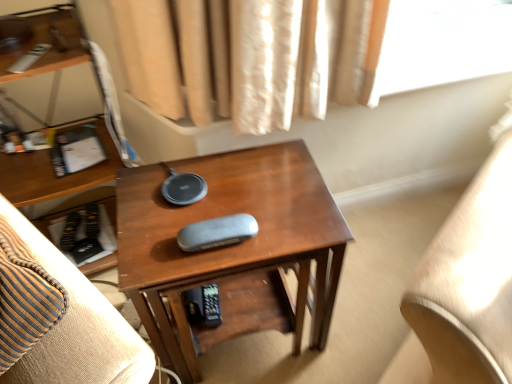
You are a GUI agent. You are given a task and a screenshot of the screen. Output one action in this format:
    pyautogui.click(x=<x>, y=<y>)
    Task: Click on the wooden side table at center
    The height and width of the screenshot is (384, 512).
    Given the screenshot: What is the action you would take?
    pyautogui.click(x=80, y=326)

What do you see at coordinates (80, 326) in the screenshot?
I see `wooden side table at center` at bounding box center [80, 326].

Measure the distance between shiny brown desk at center and camera.

A distance of 31.53 inches exists between shiny brown desk at center and camera.

The width and height of the screenshot is (512, 384). Describe the element at coordinates (231, 246) in the screenshot. I see `shiny brown desk at center` at that location.

The width and height of the screenshot is (512, 384). I want to click on shiny brown desk at center, so click(231, 246).

Locate an element on the screen. This screenshot has width=512, height=384. wooden side table at center is located at coordinates (80, 326).

Does shiny brown desk at center appear on the left side of wooden side table at center?

No, shiny brown desk at center is not to the left of wooden side table at center.

Is shiny brown desk at center closer to the viewer compared to wooden side table at center?

No, shiny brown desk at center is further to the viewer.

Is point (312, 197) positioned behind point (22, 373)?

Yes, point (312, 197) is farther from viewer.

From the image's perspective, is shiny brown desk at center positioned above or below wooden side table at center?

From the image's perspective, shiny brown desk at center appears below wooden side table at center.

From a real-world perspective, is shiny brown desk at center over wooden side table at center?

No.

Between shiny brown desk at center and wooden side table at center, which one has larger width?

Wider between the two is wooden side table at center.

Which of these two, shiny brown desk at center or wooden side table at center, stands taller?

Standing taller between the two is shiny brown desk at center.

Does shiny brown desk at center have a larger size compared to wooden side table at center?

Indeed, shiny brown desk at center has a larger size compared to wooden side table at center.

Based on the photo, is shiny brown desk at center inside the boundaries of wooden side table at center, or outside?

shiny brown desk at center is not enclosed by wooden side table at center.

Can you see shiny brown desk at center touching wooden side table at center?

No, shiny brown desk at center is not beside wooden side table at center.

Could you tell me if shiny brown desk at center is facing wooden side table at center?

No, shiny brown desk at center is not facing towards wooden side table at center.

What's the angular difference between shiny brown desk at center and wooden side table at center's facing directions?

The angular difference between shiny brown desk at center and wooden side table at center is 22.4 degrees.

How distant is shiny brown desk at center from wooden side table at center?

The distance of shiny brown desk at center from wooden side table at center is 37.29 centimeters.

This screenshot has height=384, width=512. Find the location of `desk on the right of wooden side table at center`. desk on the right of wooden side table at center is located at coordinates pos(231,246).

Would you say wooden side table at center is to the left or to the right of shiny brown desk at center in the picture?

In the image, wooden side table at center appears on the left side of shiny brown desk at center.

Is wooden side table at center further to the viewer compared to shiny brown desk at center?

No, wooden side table at center is closer to the camera.

Which point is more forward, (137, 377) or (285, 184)?

Point (137, 377)

From the image's perspective, does wooden side table at center appear higher than shiny brown desk at center?

Correct, wooden side table at center appears higher than shiny brown desk at center in the image.

From a real-world perspective, between wooden side table at center and shiny brown desk at center, who is vertically higher?

From a 3D spatial view, wooden side table at center is above.

In terms of width, does wooden side table at center look wider or thinner when compared to shiny brown desk at center?

In the image, wooden side table at center appears to be wider than shiny brown desk at center.

Which of these two, wooden side table at center or shiny brown desk at center, stands shorter?

Standing shorter between the two is wooden side table at center.

Who is bigger, wooden side table at center or shiny brown desk at center?

Bigger between the two is shiny brown desk at center.

Would you say wooden side table at center is inside or outside shiny brown desk at center?

wooden side table at center cannot be found inside shiny brown desk at center.

In the scene shown: Is wooden side table at center beside shiny brown desk at center?

No.

Is wooden side table at center oriented away from shiny brown desk at center?

wooden side table at center does not have its back to shiny brown desk at center.

How different are the orientations of wooden side table at center and shiny brown desk at center in degrees?

wooden side table at center and shiny brown desk at center are facing 22.4 degrees away from each other.

How distant is wooden side table at center from shiny brown desk at center?

wooden side table at center is 14.68 inches from shiny brown desk at center.

Where is `furniture on the left of the shiny brown desk at center`? furniture on the left of the shiny brown desk at center is located at coordinates pos(80,326).

Where is `desk that is below the wooden side table at center (from the image's perspective)`? This screenshot has width=512, height=384. desk that is below the wooden side table at center (from the image's perspective) is located at coordinates (231, 246).

What are the coordinates of `desk located on the right of wooden side table at center` in the screenshot? It's located at (231, 246).